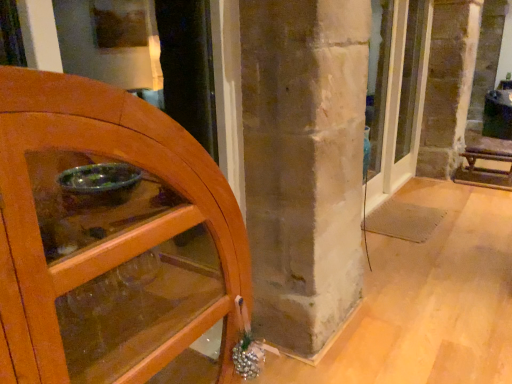
Image resolution: width=512 pixels, height=384 pixels. Describe the element at coordinates (109, 241) in the screenshot. I see `wooden cabinet at left, which is the first door from left to right` at that location.

This screenshot has height=384, width=512. In order to click on matte glass door at center, the second door from the front in this screenshot , I will do `click(396, 96)`.

Measure the distance between point (505, 189) and camera.

The depth of point (505, 189) is 4.18 meters.

Image resolution: width=512 pixels, height=384 pixels. Find the location of `wooden cabinet at left, which is the first door from left to right`. wooden cabinet at left, which is the first door from left to right is located at coordinates (109, 241).

Is wooden cabinet at left, placed as the second door when sorted from right to left, inside matte glass door at center, which is the 2th door from left to right?

Definitely not — wooden cabinet at left, placed as the second door when sorted from right to left, is not inside matte glass door at center, which is the 2th door from left to right.

Consider the image. Is matte glass door at center, which is the 2th door from left to right, at the left side of wooden cabinet at left, which is the first door from left to right?

Incorrect, matte glass door at center, which is the 2th door from left to right, is not on the left side of wooden cabinet at left, which is the first door from left to right.

Considering the relative sizes of matte glass door at center, which is the 1th door in back-to-front order, and wooden cabinet at left, which is the first door from left to right, in the image provided, is matte glass door at center, which is the 1th door in back-to-front order, taller than wooden cabinet at left, which is the first door from left to right,?

Yes.

Does matte glass door at center, the second door from the front, turn towards wooden cabinet at left, the 1th door viewed from the front?

No, matte glass door at center, the second door from the front, is not turned towards wooden cabinet at left, the 1th door viewed from the front.

Is wooden bench at right beside matte glass door at center, which is counted as the 1th door, starting from the right?

wooden bench at right and matte glass door at center, which is counted as the 1th door, starting from the right, are not in contact.

Can you confirm if wooden bench at right is taller than matte glass door at center, which is counted as the 1th door, starting from the right?

No.

Between wooden bench at right and matte glass door at center, the second door from the front, which one has larger size?

With larger size is matte glass door at center, the second door from the front.

Is wooden bench at right not inside matte glass door at center, which is the 1th door in back-to-front order?

Yes, wooden bench at right is located beyond the bounds of matte glass door at center, which is the 1th door in back-to-front order.

Is matte glass door at center, which is the 1th door in back-to-front order, at the right side of wooden bench at right?

Incorrect, matte glass door at center, which is the 1th door in back-to-front order, is not on the right side of wooden bench at right.

From a real-world perspective, is matte glass door at center, the second door from the front, above or below wooden bench at right?

matte glass door at center, the second door from the front, is situated higher than wooden bench at right in the real world.

Image resolution: width=512 pixels, height=384 pixels. Find the location of `door that is the 2nd one above the wooden bench at right (from a real-world perspective)`. door that is the 2nd one above the wooden bench at right (from a real-world perspective) is located at coordinates (396, 96).

Considering the positions of objects matte glass door at center, which is the 2th door from left to right, and wooden bench at right in the image provided, who is behind, matte glass door at center, which is the 2th door from left to right, or wooden bench at right?

Positioned behind is wooden bench at right.

Are wooden bench at right and wooden cabinet at left, which is the first door from left to right, located far from each other?

wooden bench at right is positioned a significant distance from wooden cabinet at left, which is the first door from left to right.

Consider the image. Between wooden bench at right and wooden cabinet at left, which is the first door from left to right, which one has less height?

wooden bench at right is shorter.

Considering the sizes of objects wooden bench at right and wooden cabinet at left, placed as the second door when sorted from right to left, in the image provided, who is bigger, wooden bench at right or wooden cabinet at left, placed as the second door when sorted from right to left,?

wooden cabinet at left, placed as the second door when sorted from right to left, is bigger.

Does wooden bench at right turn towards wooden cabinet at left, the 1th door viewed from the front?

No, wooden bench at right is not oriented towards wooden cabinet at left, the 1th door viewed from the front.

How far apart are wooden cabinet at left, the 1th door viewed from the front, and matte glass door at center, which is counted as the 1th door, starting from the right?

2.85 meters.

From a real-world perspective, who is located higher, wooden cabinet at left, the 2th door in the back-to-front sequence, or matte glass door at center, which is the 1th door in back-to-front order?

In real-world perspective, matte glass door at center, which is the 1th door in back-to-front order, is above.

Looking at this image, is wooden cabinet at left, the 2th door in the back-to-front sequence, turned away from matte glass door at center, which is counted as the 1th door, starting from the right?

No.

Are wooden cabinet at left, placed as the second door when sorted from right to left, and matte glass door at center, which is the 2th door from left to right, far apart?

wooden cabinet at left, placed as the second door when sorted from right to left, is positioned a significant distance from matte glass door at center, which is the 2th door from left to right.

Who is smaller, wooden cabinet at left, the 1th door viewed from the front, or wooden bench at right?

With smaller size is wooden bench at right.

Is wooden cabinet at left, the 1th door viewed from the front, taller than wooden bench at right?

Correct, wooden cabinet at left, the 1th door viewed from the front, is much taller as wooden bench at right.

Which object is closer to the camera, wooden cabinet at left, the 2th door in the back-to-front sequence, or wooden bench at right?

Positioned in front is wooden cabinet at left, the 2th door in the back-to-front sequence.

What's the angular difference between wooden cabinet at left, the 2th door in the back-to-front sequence, and wooden bench at right's facing directions?

2.06 degrees.

This screenshot has height=384, width=512. I want to click on door above the wooden cabinet at left, the 2th door in the back-to-front sequence (from the image's perspective), so click(396, 96).

Image resolution: width=512 pixels, height=384 pixels. There is a wooden bench at right. Identify the location of the 2nd door above it (from a real-world perspective). (396, 96).

Considering their positions, is wooden cabinet at left, the 1th door viewed from the front, positioned further to matte glass door at center, the second door from the front, than wooden bench at right?

wooden cabinet at left, the 1th door viewed from the front, is positioned further to the anchor matte glass door at center, the second door from the front.

In the scene shown: Which object lies nearer to the anchor point wooden bench at right, wooden cabinet at left, the 1th door viewed from the front, or matte glass door at center, the second door from the front?

Among the two, matte glass door at center, the second door from the front, is located nearer to wooden bench at right.

Which object lies further to the anchor point wooden cabinet at left, the 2th door in the back-to-front sequence, matte glass door at center, which is the 2th door from left to right, or wooden bench at right?

The object further to wooden cabinet at left, the 2th door in the back-to-front sequence, is wooden bench at right.

When comparing their distances from wooden bench at right, does matte glass door at center, which is the 1th door in back-to-front order, or wooden cabinet at left, placed as the second door when sorted from right to left, seem further?

wooden cabinet at left, placed as the second door when sorted from right to left, is further to wooden bench at right.

Based on their spatial positions, is wooden bench at right or wooden cabinet at left, which is the first door from left to right, closer to matte glass door at center, which is the 1th door in back-to-front order?

wooden bench at right lies closer to matte glass door at center, which is the 1th door in back-to-front order, than the other object.

Looking at this image, based on their spatial positions, is wooden bench at right or matte glass door at center, which is the 1th door in back-to-front order, closer to wooden cabinet at left, placed as the second door when sorted from right to left?

matte glass door at center, which is the 1th door in back-to-front order.

Find the location of a particular element. This screenshot has width=512, height=384. door located between wooden cabinet at left, placed as the second door when sorted from right to left, and wooden bench at right in the depth direction is located at coordinates (396, 96).